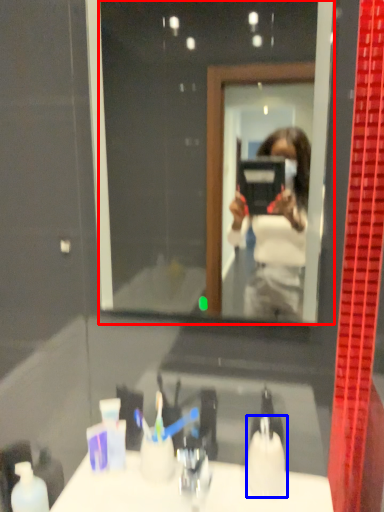
Question: Which object appears closest to the camera in this image, mirror (highlighted by a red box) or toiletry (highlighted by a blue box)?

Choices:
 (A) mirror
 (B) toiletry

Answer: (A)